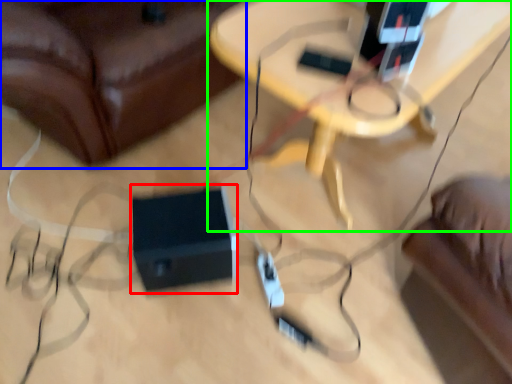
Question: Which object is the closest to the speaker (highlighted by a red box)? Choose among these: furniture (highlighted by a blue box) or table (highlighted by a green box).

Choices:
 (A) furniture
 (B) table

Answer: (A)